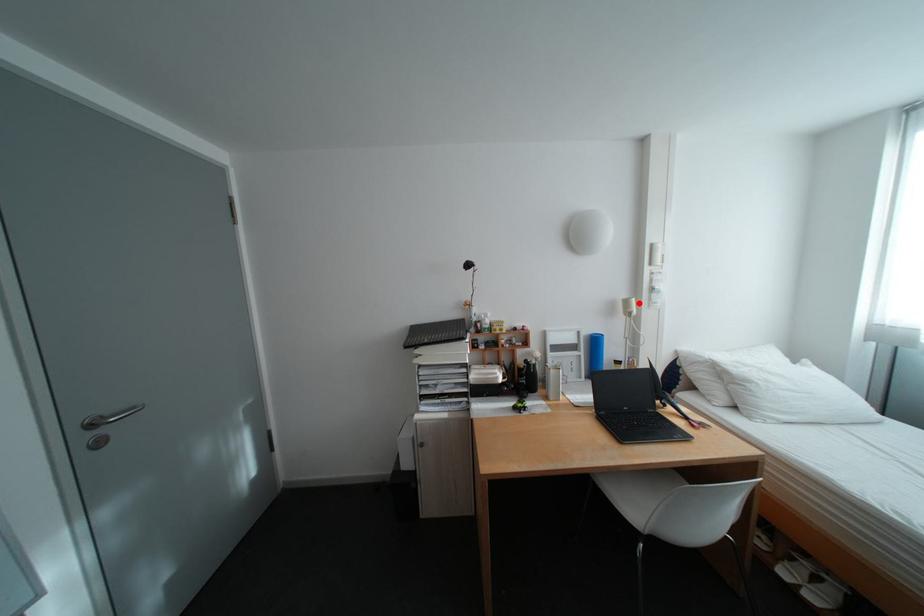
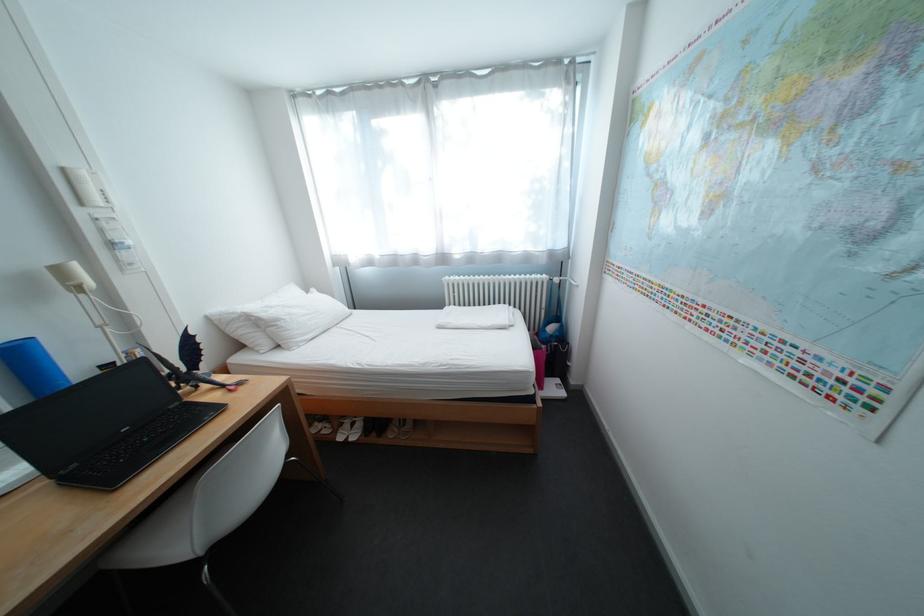
Find the pixel in the second image that matches the highlighted location in the first image.

(71, 272)